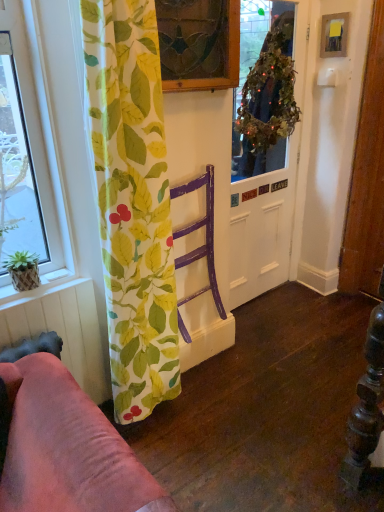
Question: Considering the positions of point (28, 258) and point (244, 242), is point (28, 258) closer or farther from the camera than point (244, 242)?

Choices:
 (A) closer
 (B) farther

Answer: (A)

Question: Is green woven basket at lower left inside the boundaries of green leafy wreath at center, or outside?

Choices:
 (A) outside
 (B) inside

Answer: (A)

Question: Estimate the real-world distances between objects in this image. Which object is closer to the stained glass window at upper center?

Choices:
 (A) green leafy wreath at upper center
 (B) purple wood chair at center
 (C) green woven basket at lower left
 (D) woven bamboo plant pot at lower left
 (E) metallic silver picture frame at upper right

Answer: (B)

Question: Based on their relative distances, which object is nearer to the stained glass window at upper center?

Choices:
 (A) green woven basket at lower left
 (B) green leafy wreath at upper center
 (C) green leafy wreath at center
 (D) green leaf-patterned fabric at left
 (E) woven bamboo plant pot at lower left

Answer: (D)